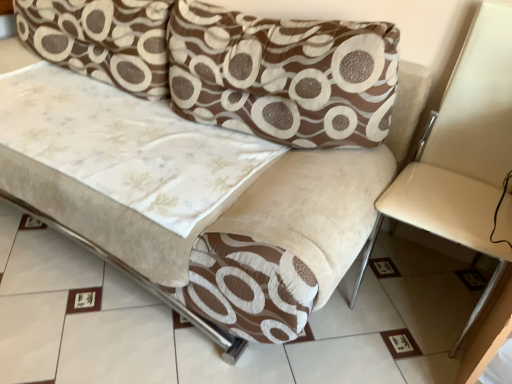
You are a GUI agent. You are given a task and a screenshot of the screen. Output one action in this format:
    pyautogui.click(x=<x>, y=<y>)
    Task: Click on the brown textured pillow at upper center, which is counted as the 1th pillow, starting from the right
    
    Given the screenshot: What is the action you would take?
    pyautogui.click(x=283, y=75)

Is brown textured pillow at upper center, which is the second pillow in left-to-right order, at the left side of beige fabric armchair at right?

Yes.

Who is bigger, brown textured pillow at upper center, which is the second pillow in left-to-right order, or beige fabric armchair at right?

beige fabric armchair at right is bigger.

Is brown textured pillow at upper center, which is counted as the 1th pillow, starting from the right, wider or thinner than beige fabric armchair at right?

Clearly, brown textured pillow at upper center, which is counted as the 1th pillow, starting from the right, has less width compared to beige fabric armchair at right.

Identify the location of armchair on the right of brown textured pillow at upper center, which is counted as the 1th pillow, starting from the right. The height and width of the screenshot is (384, 512). (464, 155).

Is point (490, 16) closer to viewer compared to point (372, 62)?

That is False.

Can you confirm if beige fabric armchair at right is wider than brown textured pillow at upper center, which is counted as the 1th pillow, starting from the right?

Yes, beige fabric armchair at right is wider than brown textured pillow at upper center, which is counted as the 1th pillow, starting from the right.

Which object is further away from the camera, beige fabric armchair at right or brown textured pillow at upper center, which is the second pillow in left-to-right order?

brown textured pillow at upper center, which is the second pillow in left-to-right order, is further from the camera.

Is beige fabric armchair at right oriented towards brown textured pillow at upper center, which is counted as the 1th pillow, starting from the right?

No, beige fabric armchair at right does not turn towards brown textured pillow at upper center, which is counted as the 1th pillow, starting from the right.

Can you confirm if beige fabric armchair at right is thinner than brown textured pillow at upper left, arranged as the first pillow when viewed from the left?

No, beige fabric armchair at right is not thinner than brown textured pillow at upper left, arranged as the first pillow when viewed from the left.

Considering the relative positions of beige fabric armchair at right and brown textured pillow at upper left, the 2th pillow when ordered from right to left, in the image provided, is beige fabric armchair at right in front of brown textured pillow at upper left, the 2th pillow when ordered from right to left,?

Yes, beige fabric armchair at right is in front of brown textured pillow at upper left, the 2th pillow when ordered from right to left.

Considering the positions of point (447, 217) and point (36, 46), is point (447, 217) closer or farther from the camera than point (36, 46)?

Clearly, point (447, 217) is closer to the camera than point (36, 46).

Is brown textured pillow at upper center, which is the second pillow in left-to-right order, next to brown textured pillow at upper left, arranged as the first pillow when viewed from the left?

No, brown textured pillow at upper center, which is the second pillow in left-to-right order, is not next to brown textured pillow at upper left, arranged as the first pillow when viewed from the left.

From the picture: Does brown textured pillow at upper center, which is counted as the 1th pillow, starting from the right, turn towards brown textured pillow at upper left, arranged as the first pillow when viewed from the left?

No, brown textured pillow at upper center, which is counted as the 1th pillow, starting from the right, is not facing towards brown textured pillow at upper left, arranged as the first pillow when viewed from the left.

Which is closer, (x=234, y=60) or (x=88, y=24)?

Point (x=234, y=60) is positioned closer to the camera compared to point (x=88, y=24).

Is brown textured pillow at upper left, the 2th pillow when ordered from right to left, in contact with brown textured pillow at upper center, which is the second pillow in left-to-right order?

brown textured pillow at upper left, the 2th pillow when ordered from right to left, and brown textured pillow at upper center, which is the second pillow in left-to-right order, are not in contact.

At what (x,y) coordinates should I click in order to perform the action: click on pillow that appears on the left of brown textured pillow at upper center, which is counted as the 1th pillow, starting from the right. Please return your answer as a coordinate pair (x, y). This screenshot has height=384, width=512. Looking at the image, I should click on (101, 39).

Can we say brown textured pillow at upper left, the 2th pillow when ordered from right to left, lies outside brown textured pillow at upper center, which is counted as the 1th pillow, starting from the right?

Yes, brown textured pillow at upper left, the 2th pillow when ordered from right to left, is not within brown textured pillow at upper center, which is counted as the 1th pillow, starting from the right.

Considering the positions of objects brown textured pillow at upper left, arranged as the first pillow when viewed from the left, and brown textured pillow at upper center, which is the second pillow in left-to-right order, in the image provided, who is behind, brown textured pillow at upper left, arranged as the first pillow when viewed from the left, or brown textured pillow at upper center, which is the second pillow in left-to-right order,?

brown textured pillow at upper left, arranged as the first pillow when viewed from the left, is further from the camera.

Would you say brown textured pillow at upper left, arranged as the first pillow when viewed from the left, contains beige fabric armchair at right?

No, beige fabric armchair at right is not a part of brown textured pillow at upper left, arranged as the first pillow when viewed from the left.

From a real-world perspective, is brown textured pillow at upper left, the 2th pillow when ordered from right to left, located beneath beige fabric armchair at right?

Actually, brown textured pillow at upper left, the 2th pillow when ordered from right to left, is physically above beige fabric armchair at right in the real world.

Is point (137, 41) farther from viewer compared to point (405, 189)?

Yes, it is behind point (405, 189).

Is brown textured pillow at upper left, arranged as the first pillow when viewed from the left, facing away from beige fabric armchair at right?

No, beige fabric armchair at right is not at the back of brown textured pillow at upper left, arranged as the first pillow when viewed from the left.

In the image, there is a brown textured pillow at upper center, which is the second pillow in left-to-right order. Identify the location of armchair below it (from the image's perspective). (464, 155).

At what (x,y) coordinates should I click in order to perform the action: click on pillow that is the 1st one when counting backward from the beige fabric armchair at right. Please return your answer as a coordinate pair (x, y). This screenshot has height=384, width=512. Looking at the image, I should click on (283, 75).

Which object lies nearer to the anchor point brown textured pillow at upper center, which is counted as the 1th pillow, starting from the right, beige fabric armchair at right or brown textured pillow at upper left, the 2th pillow when ordered from right to left?

brown textured pillow at upper left, the 2th pillow when ordered from right to left.

When comparing their distances from brown textured pillow at upper left, arranged as the first pillow when viewed from the left, does brown textured pillow at upper center, which is counted as the 1th pillow, starting from the right, or beige fabric armchair at right seem further?

The object further to brown textured pillow at upper left, arranged as the first pillow when viewed from the left, is beige fabric armchair at right.

Considering their positions, is beige fabric armchair at right positioned closer to brown textured pillow at upper left, the 2th pillow when ordered from right to left, than brown textured pillow at upper center, which is the second pillow in left-to-right order?

brown textured pillow at upper center, which is the second pillow in left-to-right order, is closer to brown textured pillow at upper left, the 2th pillow when ordered from right to left.

Estimate the real-world distances between objects in this image. Which object is further from beige fabric armchair at right, brown textured pillow at upper left, the 2th pillow when ordered from right to left, or brown textured pillow at upper center, which is counted as the 1th pillow, starting from the right?

brown textured pillow at upper left, the 2th pillow when ordered from right to left.

Looking at the image, which one is located closer to brown textured pillow at upper center, which is counted as the 1th pillow, starting from the right, brown textured pillow at upper left, the 2th pillow when ordered from right to left, or beige fabric armchair at right?

Based on the image, brown textured pillow at upper left, the 2th pillow when ordered from right to left, appears to be nearer to brown textured pillow at upper center, which is counted as the 1th pillow, starting from the right.

Estimate the real-world distances between objects in this image. Which object is further from beige fabric armchair at right, brown textured pillow at upper center, which is the second pillow in left-to-right order, or brown textured pillow at upper left, the 2th pillow when ordered from right to left?

Among the two, brown textured pillow at upper left, the 2th pillow when ordered from right to left, is located further to beige fabric armchair at right.

Locate an element on the screen. This screenshot has height=384, width=512. pillow situated between brown textured pillow at upper left, arranged as the first pillow when viewed from the left, and beige fabric armchair at right from left to right is located at coordinates (283, 75).